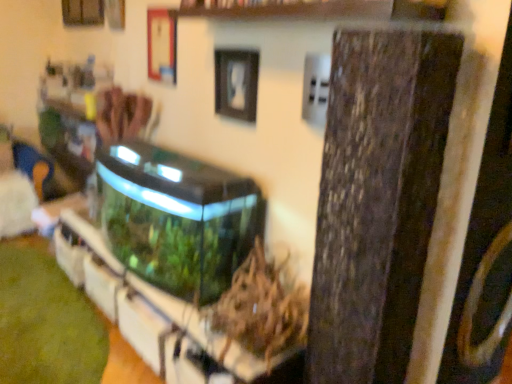
You are a GUI agent. You are given a task and a screenshot of the screen. Output one action in this format:
    pyautogui.click(x=<x>, y=<y>)
    Task: Click on the transparent glass aquarium at center, acting as the first shelf starting from the bottom
    
    Given the screenshot: What is the action you would take?
    160,318

In order to click on transparent glass aquarium at center, acting as the first shelf starting from the bottom in this screenshot , I will do `click(160, 318)`.

Based on the photo, from the image's perspective, between transparent glass water tank at center and black matte picture frame at upper center, who is located below?

From the image's view, transparent glass water tank at center is below.

The image size is (512, 384). I want to click on picture frame on the right of transparent glass water tank at center, so click(x=236, y=83).

Is black matte picture frame at upper center completely or partially inside transparent glass water tank at center?

No, black matte picture frame at upper center is located outside of transparent glass water tank at center.

Is transparent glass water tank at center far from black matte picture frame at upper center?

No.

Looking at their sizes, would you say black matte picture frame at upper center is wider or thinner than green matte plant at center?

Considering their sizes, black matte picture frame at upper center looks slimmer than green matte plant at center.

Is black matte picture frame at upper center further to camera compared to green matte plant at center?

Yes, the depth of black matte picture frame at upper center is greater than that of green matte plant at center.

Which object is positioned more to the left, black matte picture frame at upper center or green matte plant at center?

Positioned to the left is black matte picture frame at upper center.

Is black matte picture frame at upper center turned away from green matte plant at center?

No.

Does transparent glass water tank at center come in front of transparent glass aquarium at center, acting as the second shelf starting from the top?

No.

Between transparent glass water tank at center and transparent glass aquarium at center, acting as the first shelf starting from the bottom, which one appears on the left side from the viewer's perspective?

From the viewer's perspective, transparent glass aquarium at center, acting as the first shelf starting from the bottom, appears more on the left side.

Is transparent glass water tank at center shorter than transparent glass aquarium at center, acting as the second shelf starting from the top?

Incorrect, the height of transparent glass water tank at center does not fall short of that of transparent glass aquarium at center, acting as the second shelf starting from the top.

Considering their positions, is green matte plant at center located in front of or behind transparent glass water tank at center?

Visually, green matte plant at center is located in front of transparent glass water tank at center.

Does green matte plant at center appear on the right side of transparent glass water tank at center?

Indeed, green matte plant at center is positioned on the right side of transparent glass water tank at center.

Is green matte plant at center positioned far away from transparent glass water tank at center?

They are positioned close to each other.

Looking at this image, based on their positions, is black matte picture frame at upper center located to the left or right of transparent glass aquarium at center, acting as the second shelf starting from the top?

black matte picture frame at upper center is to the right of transparent glass aquarium at center, acting as the second shelf starting from the top.

How many degrees apart are the facing directions of black matte picture frame at upper center and transparent glass aquarium at center, acting as the first shelf starting from the bottom?

The angle between the facing direction of black matte picture frame at upper center and the facing direction of transparent glass aquarium at center, acting as the first shelf starting from the bottom, is 1.36 degrees.

Is point (237, 90) positioned in front of point (143, 311)?

That is True.

In the scene shown: Looking at their sizes, would you say black matte picture frame at upper center is wider or thinner than transparent glass aquarium at center, acting as the second shelf starting from the top?

Clearly, black matte picture frame at upper center has less width compared to transparent glass aquarium at center, acting as the second shelf starting from the top.

Does transparent glass aquarium at center, acting as the first shelf starting from the bottom, contain black matte picture frame at upper center?

No, black matte picture frame at upper center is not surrounded by transparent glass aquarium at center, acting as the first shelf starting from the bottom.

Is transparent glass aquarium at center, acting as the second shelf starting from the top, wider than black matte picture frame at upper center?

Yes.

Can you confirm if transparent glass aquarium at center, acting as the second shelf starting from the top, is positioned to the left of black matte picture frame at upper center?

Indeed, transparent glass aquarium at center, acting as the second shelf starting from the top, is positioned on the left side of black matte picture frame at upper center.

How different are the orientations of transparent glass aquarium at center, acting as the second shelf starting from the top, and green matte plant at center in degrees?

They differ by 0.00714 degrees in their facing directions.

Can you confirm if transparent glass aquarium at center, acting as the first shelf starting from the bottom, is positioned to the left of green matte plant at center?

Yes, transparent glass aquarium at center, acting as the first shelf starting from the bottom, is to the left of green matte plant at center.

Where is `shelf behind the green matte plant at center`? The image size is (512, 384). shelf behind the green matte plant at center is located at coordinates (160, 318).

Based on the photo, measure the distance from transparent glass aquarium at center, acting as the first shelf starting from the bottom, to green matte plant at center.

transparent glass aquarium at center, acting as the first shelf starting from the bottom, and green matte plant at center are 10.77 inches apart.

Locate an element on the screen. The width and height of the screenshot is (512, 384). water tank in front of the black matte picture frame at upper center is located at coordinates (177, 218).

The height and width of the screenshot is (384, 512). In order to click on plant on the right side of black matte picture frame at upper center in this screenshot , I will do `click(262, 308)`.

Based on their spatial positions, is transparent glass aquarium at center, acting as the second shelf starting from the top, or green matte plant at center closer to black matte picture frame at upper center?

green matte plant at center is closer to black matte picture frame at upper center.

When comparing their distances from black matte picture frame at upper center, does wooden at upper center, which is the 2th shelf from bottom to top, or green matte plant at center seem further?

green matte plant at center is positioned further to the anchor black matte picture frame at upper center.

Which object lies nearer to the anchor point transparent glass aquarium at center, acting as the first shelf starting from the bottom, transparent glass water tank at center or wooden at upper center, the first shelf positioned from the top?

Based on the image, transparent glass water tank at center appears to be nearer to transparent glass aquarium at center, acting as the first shelf starting from the bottom.

Which object lies nearer to the anchor point transparent glass water tank at center, wooden at upper center, the first shelf positioned from the top, or transparent glass aquarium at center, acting as the second shelf starting from the top?

transparent glass aquarium at center, acting as the second shelf starting from the top.

When comparing their distances from wooden at upper center, which is the 2th shelf from bottom to top, does transparent glass water tank at center or black matte picture frame at upper center seem closer?

black matte picture frame at upper center.

When comparing their distances from wooden at upper center, which is the 2th shelf from bottom to top, does green matte plant at center or transparent glass water tank at center seem closer?

Based on the image, transparent glass water tank at center appears to be nearer to wooden at upper center, which is the 2th shelf from bottom to top.

Estimate the real-world distances between objects in this image. Which object is further from transparent glass aquarium at center, acting as the first shelf starting from the bottom, black matte picture frame at upper center or green matte plant at center?

black matte picture frame at upper center is further to transparent glass aquarium at center, acting as the first shelf starting from the bottom.

Considering their positions, is wooden at upper center, the first shelf positioned from the top, positioned closer to transparent glass aquarium at center, acting as the first shelf starting from the bottom, than black matte picture frame at upper center?

black matte picture frame at upper center is closer to transparent glass aquarium at center, acting as the first shelf starting from the bottom.

This screenshot has width=512, height=384. What are the coordinates of `water tank located between transparent glass aquarium at center, acting as the second shelf starting from the top, and green matte plant at center in the left-right direction` in the screenshot? It's located at (177, 218).

This screenshot has height=384, width=512. Find the location of `water tank between wooden at upper center, the first shelf positioned from the top, and black matte picture frame at upper center from front to back`. water tank between wooden at upper center, the first shelf positioned from the top, and black matte picture frame at upper center from front to back is located at coordinates 177,218.

Identify the location of picture frame between wooden at upper center, the first shelf positioned from the top, and transparent glass aquarium at center, acting as the first shelf starting from the bottom, from top to bottom. The image size is (512, 384). (236, 83).

In order to click on plant between black matte picture frame at upper center and transparent glass aquarium at center, acting as the second shelf starting from the top, from top to bottom in this screenshot , I will do `click(262, 308)`.